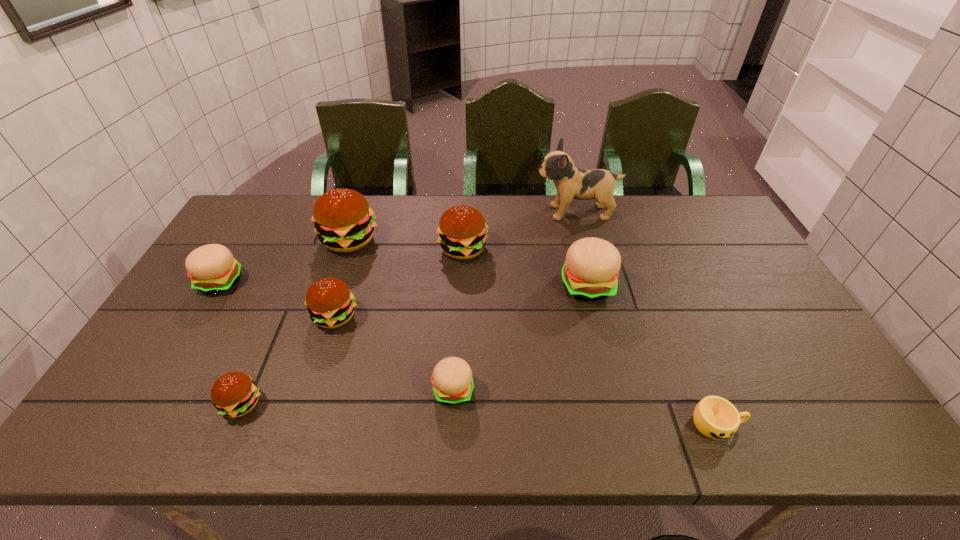
You are a GUI agent. You are given a task and a screenshot of the screen. Output one action in this format:
    pyautogui.click(x=<x>, y=<y>)
    Task: Click on the free spot at the right edge of the desktop
    This screenshot has width=960, height=540.
    Given the screenshot: What is the action you would take?
    pyautogui.click(x=700, y=237)

This screenshot has width=960, height=540. Identify the location of free point at the near right corner. (833, 420).

Locate an element on the screen. free space between the nearest brown hamburger and the smallest beige hamburger is located at coordinates (348, 397).

The height and width of the screenshot is (540, 960). I want to click on free point between the leftmost hamburger and the second biggest brown hamburger, so click(x=342, y=265).

I want to click on empty space between the tallest object and the leftmost hamburger, so click(x=398, y=247).

The image size is (960, 540). Identify the location of empty space between the biggest beige hamburger and the nearest beige hamburger. (520, 338).

Locate an element on the screen. This screenshot has width=960, height=540. vacant space that's between the biggest brown hamburger and the third smallest brown hamburger is located at coordinates (406, 245).

This screenshot has width=960, height=540. In order to click on vacant space in between the rightmost hamburger and the smallest beige hamburger in this screenshot , I will do click(x=520, y=338).

Where is `unoccupied position between the second smallest brown hamburger and the tallest object`? The image size is (960, 540). unoccupied position between the second smallest brown hamburger and the tallest object is located at coordinates (455, 265).

I want to click on unoccupied area between the second beige hamburger from left to right and the second smallest brown hamburger, so click(x=394, y=353).